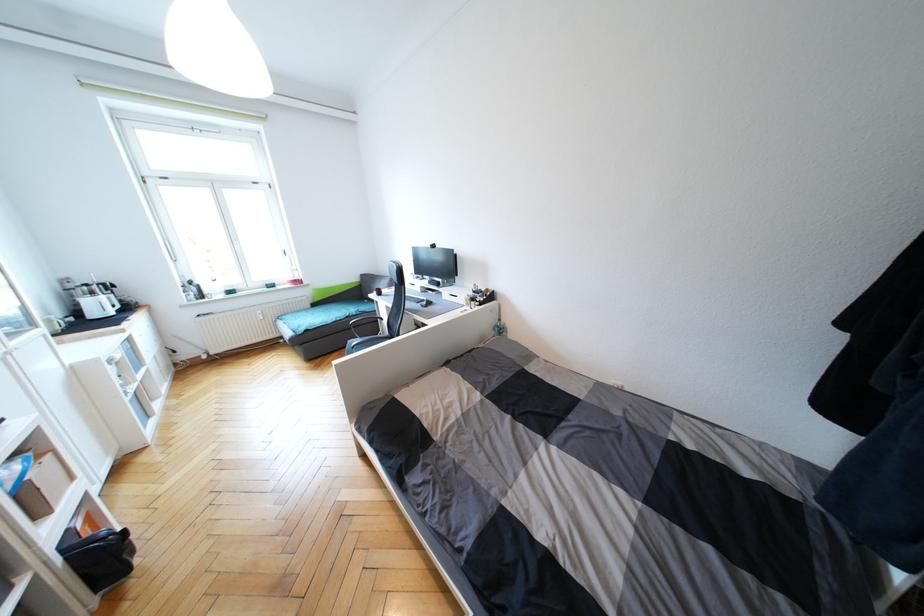
What are the coordinates of `black computer mouse` in the screenshot? It's located at (428, 302).